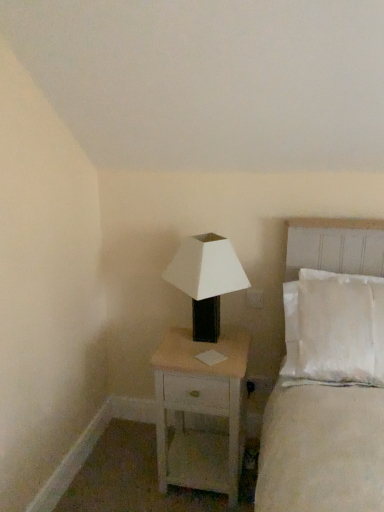
Identify the location of free spot below white matte/black textured lamp at center (from a real-world perspective). (209, 344).